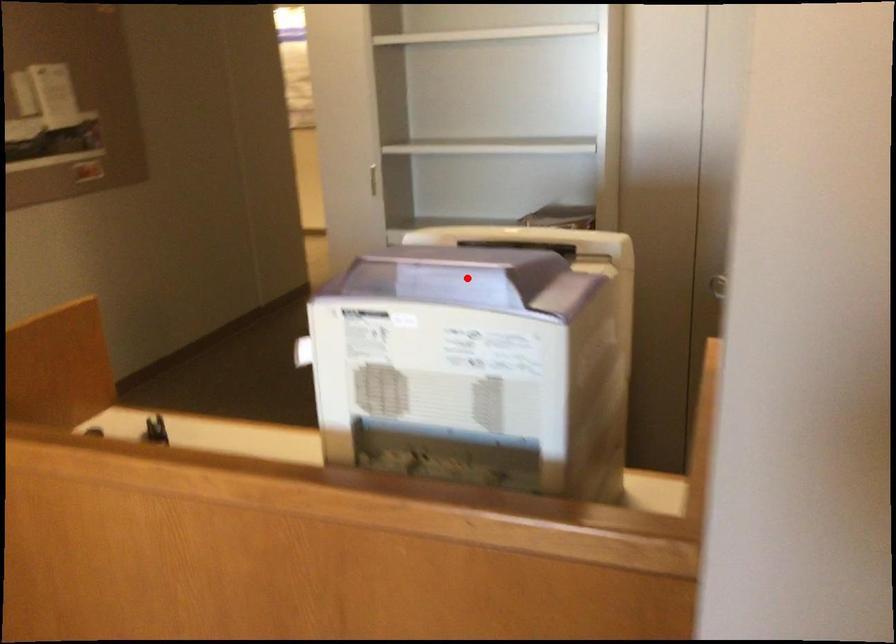
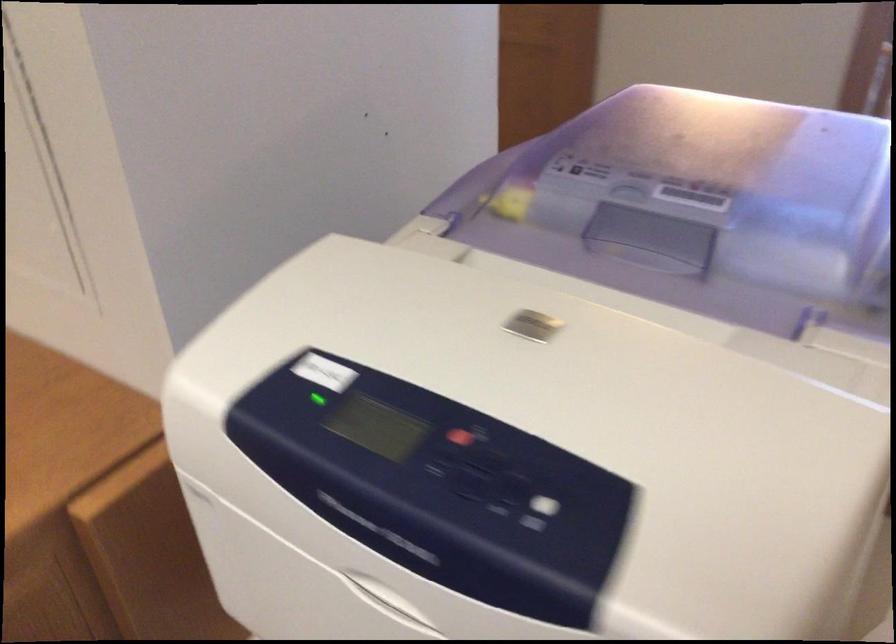
Where in the second image is the point corresponding to the highlighted location from the first image?

(656, 234)